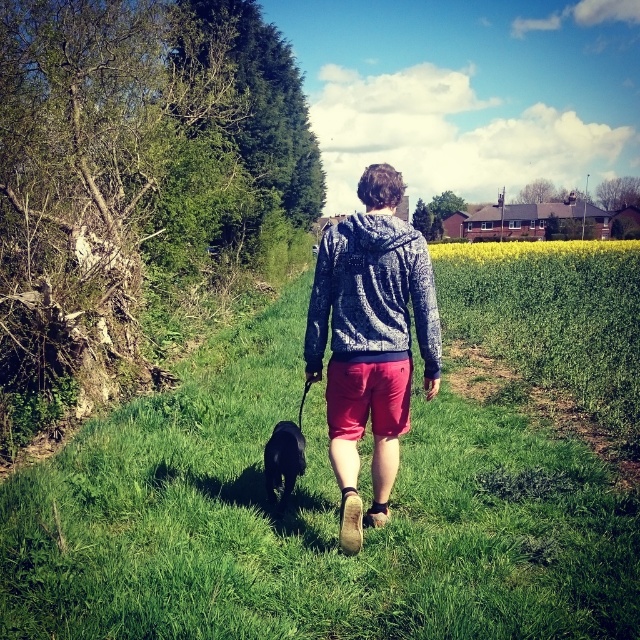
Measure the distance between speckled hoodie at center and camera.

speckled hoodie at center and camera are 14.71 feet apart.

Is point (404, 266) behind point (336, 310)?

No.

At what (x,y) coordinates should I click in order to perform the action: click on speckled hoodie at center. Please return your answer as a coordinate pair (x, y). Looking at the image, I should click on (371, 339).

Which of these two, speckled hoodie at center or black fur at center, stands taller?

With more height is speckled hoodie at center.

Between speckled hoodie at center and black fur at center, which one appears on the right side from the viewer's perspective?

speckled hoodie at center is more to the right.

Locate an element on the screen. Image resolution: width=640 pixels, height=640 pixels. speckled hoodie at center is located at coordinates (371, 339).

I want to click on speckled hoodie at center, so click(371, 339).

The width and height of the screenshot is (640, 640). I want to click on green grassy at center, so click(310, 520).

Between point (17, 636) and point (353, 310), which one is positioned behind?

The point (353, 310) is more distant.

The width and height of the screenshot is (640, 640). What are the coordinates of `green grassy at center` in the screenshot? It's located at (310, 520).